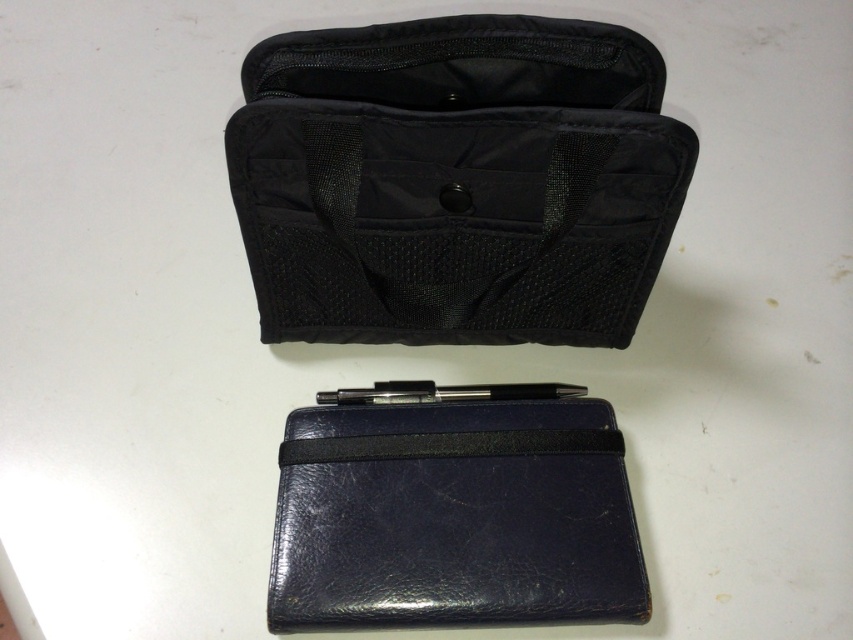
Question: Does black fabric pouch at center have a greater width compared to navy leather pouch at center?

Choices:
 (A) no
 (B) yes

Answer: (B)

Question: Which point is farther to the camera?

Choices:
 (A) (485, 486)
 (B) (379, 120)

Answer: (A)

Question: Is black fabric pouch at center smaller than navy leather pouch at center?

Choices:
 (A) yes
 (B) no

Answer: (B)

Question: Which of the following is the closest to the observer?

Choices:
 (A) navy leather pouch at center
 (B) black fabric pouch at center

Answer: (B)

Question: Can you confirm if black fabric pouch at center is positioned below navy leather pouch at center?

Choices:
 (A) yes
 (B) no

Answer: (B)

Question: Which object appears farthest from the camera in this image?

Choices:
 (A) navy leather pouch at center
 (B) black fabric pouch at center

Answer: (A)